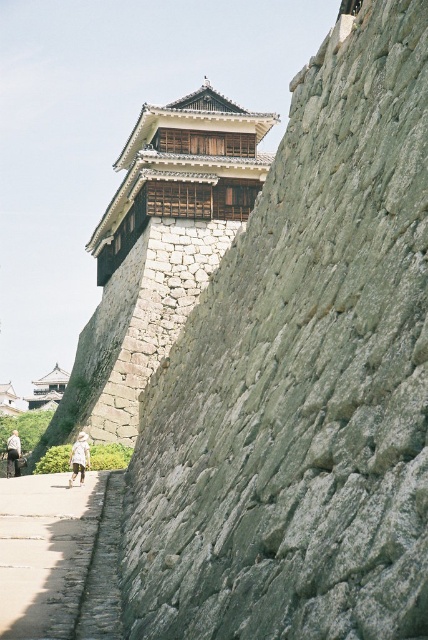
You are standing at the base of the castle wall and want to take a photo of the point at coordinates point [187,593]. Your camera has a zoom range that can focus up to 100 feet. Will you be able to capture the point in focus without moving closer?

The distance between point [187,593] and the camera is 116.99 feet, which exceeds the camera zoom range of 100 feet. Therefore, you will not be able to capture the point in focus without moving closer.

You are a tourist standing at the base of the castle wall and see the smooth concrete path at center and the white cotton shirt at lower left. Which object is closer to your current position?

The white cotton shirt at lower left is closer to your current position because it is located below the smooth concrete path at center.